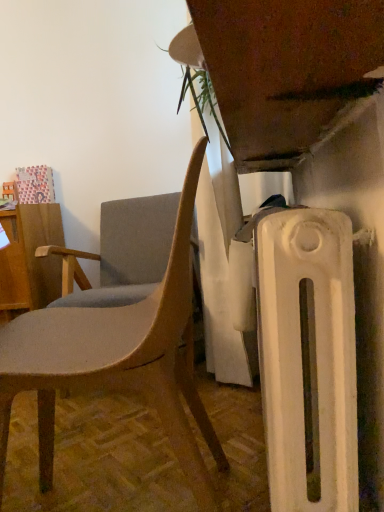
The height and width of the screenshot is (512, 384). What do you see at coordinates (117, 358) in the screenshot? I see `matte gray chair at center, which is the 2th chair in back-to-front order` at bounding box center [117, 358].

The width and height of the screenshot is (384, 512). In order to click on matte gray chair at center, which is the 2th chair in back-to-front order in this screenshot , I will do `click(117, 358)`.

Which of these two, wooden desk at left or matte gray chair at center, the first chair from the front, is bigger?

matte gray chair at center, the first chair from the front.

From a real-world perspective, is wooden desk at left physically below matte gray chair at center, the first chair from the front?

Actually, wooden desk at left is physically above matte gray chair at center, the first chair from the front, in the real world.

Can you tell me how much wooden desk at left and matte gray chair at center, the first chair from the front, differ in facing direction?

The angular difference between wooden desk at left and matte gray chair at center, the first chair from the front, is 84.9 degrees.

Which is correct: wooden desk at left is inside matte gray chair at center, the first chair from the front, or outside of it?

wooden desk at left is not enclosed by matte gray chair at center, the first chair from the front.

Is wooden desk at left closer to camera compared to matte gray fabric chair at left, positioned as the 2th chair in front-to-back order?

That is False.

What's the angular difference between wooden desk at left and matte gray fabric chair at left, positioned as the 2th chair in front-to-back order,'s facing directions?

The angle between the facing direction of wooden desk at left and the facing direction of matte gray fabric chair at left, positioned as the 2th chair in front-to-back order, is 0.000657 degrees.

Based on their positions, is wooden desk at left located to the left or right of matte gray fabric chair at left, positioned as the 2th chair in front-to-back order?

Based on their positions, wooden desk at left is located to the left of matte gray fabric chair at left, positioned as the 2th chair in front-to-back order.

Based on the photo, which is nearer, (31, 210) or (69, 262)?

Clearly, point (31, 210) is more distant from the camera than point (69, 262).

From a real-world perspective, is matte gray fabric chair at left, positioned as the 2th chair in front-to-back order, positioned under wooden desk at left based on gravity?

No.

Can you confirm if matte gray fabric chair at left, positioned as the 2th chair in front-to-back order, is positioned to the right of wooden desk at left?

Yes.

How many degrees apart are the facing directions of matte gray fabric chair at left, arranged as the first chair when viewed from the back, and wooden desk at left?

The facing directions of matte gray fabric chair at left, arranged as the first chair when viewed from the back, and wooden desk at left are 0.000657 degrees apart.

Consider the image. Is matte gray fabric chair at left, arranged as the first chair when viewed from the back, not within wooden desk at left?

Yes.

In terms of height, does matte gray chair at center, which is the 2th chair in back-to-front order, look taller or shorter compared to matte gray fabric chair at left, positioned as the 2th chair in front-to-back order?

In the image, matte gray chair at center, which is the 2th chair in back-to-front order, appears to be taller than matte gray fabric chair at left, positioned as the 2th chair in front-to-back order.

Is matte gray chair at center, which is the 2th chair in back-to-front order, far away from matte gray fabric chair at left, arranged as the first chair when viewed from the back?

matte gray chair at center, which is the 2th chair in back-to-front order, is near matte gray fabric chair at left, arranged as the first chair when viewed from the back, not far away.

Considering the relative sizes of matte gray chair at center, which is the 2th chair in back-to-front order, and matte gray fabric chair at left, arranged as the first chair when viewed from the back, in the image provided, is matte gray chair at center, which is the 2th chair in back-to-front order, wider than matte gray fabric chair at left, arranged as the first chair when viewed from the back,?

No, matte gray chair at center, which is the 2th chair in back-to-front order, is not wider than matte gray fabric chair at left, arranged as the first chair when viewed from the back.

Where is `chair that is in front of the matte gray fabric chair at left, positioned as the 2th chair in front-to-back order`? The width and height of the screenshot is (384, 512). chair that is in front of the matte gray fabric chair at left, positioned as the 2th chair in front-to-back order is located at coordinates (117, 358).

From the image's perspective, which one is positioned higher, matte gray chair at center, which is the 2th chair in back-to-front order, or wooden desk at left?

wooden desk at left.

Considering the positions of objects matte gray chair at center, which is the 2th chair in back-to-front order, and wooden desk at left in the image provided, who is more to the right, matte gray chair at center, which is the 2th chair in back-to-front order, or wooden desk at left?

From the viewer's perspective, matte gray chair at center, which is the 2th chair in back-to-front order, appears more on the right side.

Considering the sizes of objects matte gray chair at center, the first chair from the front, and wooden desk at left in the image provided, who is thinner, matte gray chair at center, the first chair from the front, or wooden desk at left?

wooden desk at left.

Looking at their sizes, would you say matte gray fabric chair at left, arranged as the first chair when viewed from the back, is wider or thinner than matte gray chair at center, the first chair from the front?

Considering their sizes, matte gray fabric chair at left, arranged as the first chair when viewed from the back, looks broader than matte gray chair at center, the first chair from the front.

Does matte gray fabric chair at left, arranged as the first chair when viewed from the back, appear on the left side of matte gray chair at center, the first chair from the front?

Correct, you'll find matte gray fabric chair at left, arranged as the first chair when viewed from the back, to the left of matte gray chair at center, the first chair from the front.

How many degrees apart are the facing directions of matte gray fabric chair at left, arranged as the first chair when viewed from the back, and matte gray chair at center, which is the 2th chair in back-to-front order?

The angle between the facing direction of matte gray fabric chair at left, arranged as the first chair when viewed from the back, and the facing direction of matte gray chair at center, which is the 2th chair in back-to-front order, is 84.9 degrees.

I want to click on chair above the matte gray chair at center, which is the 2th chair in back-to-front order (from the image's perspective), so click(x=123, y=252).

Identify the location of chair located below the wooden desk at left (from the image's perspective). The image size is (384, 512). (117, 358).

Find the location of a particular element. Image resolution: width=384 pixels, height=512 pixels. chair above the wooden desk at left (from a real-world perspective) is located at coordinates (123, 252).

From the image, which object appears to be farther from matte gray chair at center, which is the 2th chair in back-to-front order, matte gray fabric chair at left, arranged as the first chair when viewed from the back, or wooden desk at left?

wooden desk at left is further to matte gray chair at center, which is the 2th chair in back-to-front order.

Based on their spatial positions, is matte gray chair at center, which is the 2th chair in back-to-front order, or wooden desk at left further from matte gray fabric chair at left, arranged as the first chair when viewed from the back?

matte gray chair at center, which is the 2th chair in back-to-front order, is positioned further to the anchor matte gray fabric chair at left, arranged as the first chair when viewed from the back.

Looking at the image, which one is located closer to wooden desk at left, matte gray fabric chair at left, positioned as the 2th chair in front-to-back order, or matte gray chair at center, the first chair from the front?

Based on the image, matte gray fabric chair at left, positioned as the 2th chair in front-to-back order, appears to be nearer to wooden desk at left.

From the image, which object appears to be farther from matte gray fabric chair at left, positioned as the 2th chair in front-to-back order, wooden desk at left or matte gray chair at center, the first chair from the front?

matte gray chair at center, the first chair from the front, is positioned further to the anchor matte gray fabric chair at left, positioned as the 2th chair in front-to-back order.

From the image, which object appears to be nearer to wooden desk at left, matte gray chair at center, the first chair from the front, or matte gray fabric chair at left, positioned as the 2th chair in front-to-back order?

matte gray fabric chair at left, positioned as the 2th chair in front-to-back order, is positioned closer to the anchor wooden desk at left.

From the image, which object appears to be farther from matte gray chair at center, the first chair from the front, wooden desk at left or matte gray fabric chair at left, arranged as the first chair when viewed from the back?

wooden desk at left lies further to matte gray chair at center, the first chair from the front, than the other object.

I want to click on chair located between matte gray chair at center, which is the 2th chair in back-to-front order, and wooden desk at left in the depth direction, so click(x=123, y=252).